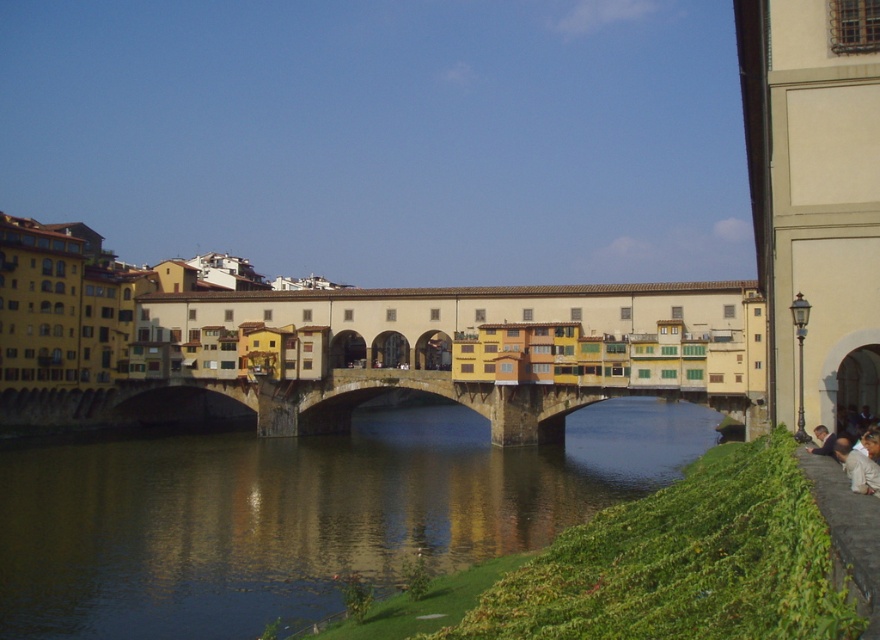
Consider the image. Does white fabric at lower right have a greater height compared to light brown leather jacket at lower right?

Yes, white fabric at lower right is taller than light brown leather jacket at lower right.

Between white fabric at lower right and light brown leather jacket at lower right, which one is positioned lower?

light brown leather jacket at lower right

This screenshot has width=880, height=640. What are the coordinates of `white fabric at lower right` in the screenshot? It's located at (864, 465).

Does stone bridge at center have a smaller size compared to white fabric at lower right?

Actually, stone bridge at center might be larger than white fabric at lower right.

This screenshot has width=880, height=640. Find the location of `stone bridge at center`. stone bridge at center is located at coordinates (325, 403).

Is point (259, 417) positioned behind point (858, 461)?

Yes, it is behind point (858, 461).

This screenshot has height=640, width=880. Find the location of `stone bridge at center`. stone bridge at center is located at coordinates (325, 403).

Between green grassy bank at lower right and stone bridge at center, which one appears on the right side from the viewer's perspective?

Positioned to the right is green grassy bank at lower right.

Which of these two, green grassy bank at lower right or stone bridge at center, stands taller?

With more height is green grassy bank at lower right.

Is point (160, 465) in front of point (103, 408)?

Yes, it is in front of point (103, 408).

This screenshot has width=880, height=640. I want to click on green grassy bank at lower right, so click(x=299, y=513).